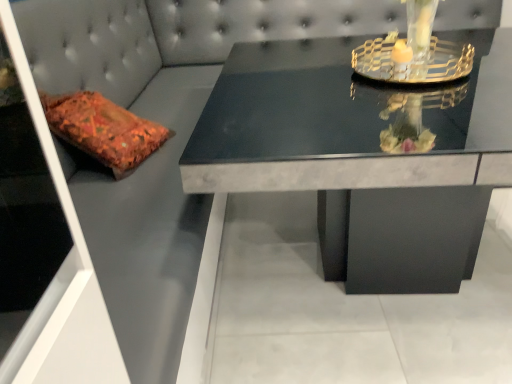
This screenshot has width=512, height=384. I want to click on black marble table at center, so click(364, 155).

What do you see at coordinates (71, 280) in the screenshot? I see `transparent glass door at left` at bounding box center [71, 280].

The image size is (512, 384). I want to click on black marble table at center, so click(x=364, y=155).

Between clear glass candle holder at upper right and black marble table at center, which one has larger width?

Wider between the two is black marble table at center.

Does clear glass candle holder at upper right have a greater height compared to black marble table at center?

In fact, clear glass candle holder at upper right may be shorter than black marble table at center.

Is clear glass candle holder at upper right facing away from black marble table at center?

No, clear glass candle holder at upper right is not facing away from black marble table at center.

Is clear glass candle holder at upper right oriented towards transparent glass door at left?

No, clear glass candle holder at upper right is not facing towards transparent glass door at left.

From their relative heights in the image, would you say clear glass candle holder at upper right is taller or shorter than transparent glass door at left?

clear glass candle holder at upper right is shorter than transparent glass door at left.

From the picture: Measure the distance between clear glass candle holder at upper right and transparent glass door at left.

clear glass candle holder at upper right and transparent glass door at left are 1.20 meters apart from each other.

Consider the image. Are clear glass candle holder at upper right and transparent glass door at left making contact?

No, clear glass candle holder at upper right is not touching transparent glass door at left.

Is clear glass candle holder at upper right at the back of black marble table at center?

No, clear glass candle holder at upper right is not at the back of black marble table at center.

Considering the relative positions of black marble table at center and clear glass candle holder at upper right in the image provided, is black marble table at center to the left of clear glass candle holder at upper right from the viewer's perspective?

Yes.

Is black marble table at center wider than clear glass candle holder at upper right?

Yes, black marble table at center is wider than clear glass candle holder at upper right.

Is point (403, 203) farther from camera compared to point (385, 64)?

Yes, point (403, 203) is behind point (385, 64).

From the picture: Is transparent glass door at left closer to the viewer compared to clear glass candle holder at upper right?

Yes, it is in front of clear glass candle holder at upper right.

From a real-world perspective, is transparent glass door at left over clear glass candle holder at upper right?

Actually, transparent glass door at left is physically below clear glass candle holder at upper right in the real world.

Which is in front, point (24, 331) or point (446, 77)?

Point (24, 331)

Considering the relative sizes of transparent glass door at left and clear glass candle holder at upper right in the image provided, is transparent glass door at left wider than clear glass candle holder at upper right?

Indeed, transparent glass door at left has a greater width compared to clear glass candle holder at upper right.

Which is in front, point (37, 344) or point (302, 188)?

The point (37, 344) is more forward.

Between transparent glass door at left and black marble table at center, which one has larger width?

Wider between the two is black marble table at center.

Is there a large distance between transparent glass door at left and black marble table at center?

Actually, transparent glass door at left and black marble table at center are a little close together.

How far apart are black marble table at center and transparent glass door at left?

They are 30.35 inches apart.

Are black marble table at center and transparent glass door at left located far from each other?

No, there isn't a large distance between black marble table at center and transparent glass door at left.

Which of these two, black marble table at center or transparent glass door at left, is bigger?

Bigger between the two is black marble table at center.

The height and width of the screenshot is (384, 512). What are the coordinates of `candle holder located above the black marble table at center (from the image's perspective)` in the screenshot? It's located at (414, 52).

Identify the location of glass door in front of the clear glass candle holder at upper right. The width and height of the screenshot is (512, 384). (71, 280).

Considering their positions, is clear glass candle holder at upper right positioned closer to transparent glass door at left than black marble table at center?

black marble table at center.

From the picture: From the image, which object appears to be farther from clear glass candle holder at upper right, transparent glass door at left or black marble table at center?

Among the two, transparent glass door at left is located further to clear glass candle holder at upper right.

From the image, which object appears to be nearer to clear glass candle holder at upper right, black marble table at center or transparent glass door at left?

The object closer to clear glass candle holder at upper right is black marble table at center.

Considering their positions, is black marble table at center positioned closer to transparent glass door at left than clear glass candle holder at upper right?

Among the two, black marble table at center is located nearer to transparent glass door at left.

When comparing their distances from black marble table at center, does transparent glass door at left or clear glass candle holder at upper right seem closer?

The object closer to black marble table at center is clear glass candle holder at upper right.

Based on their spatial positions, is clear glass candle holder at upper right or transparent glass door at left further from black marble table at center?

Among the two, transparent glass door at left is located further to black marble table at center.

Locate an element on the screen. table between transparent glass door at left and clear glass candle holder at upper right in the horizontal direction is located at coordinates (364, 155).